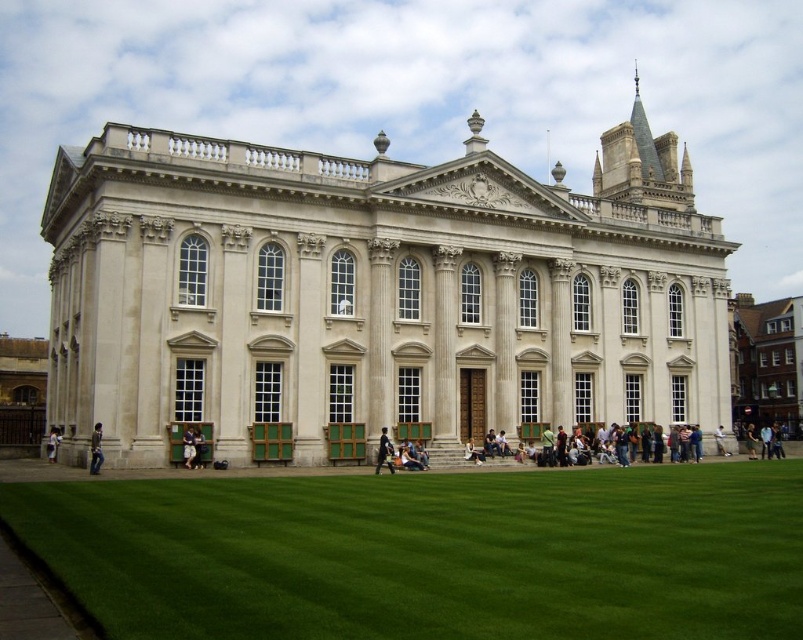
Who is higher up, green grass at lower center or light brown wooden bench at center?

green grass at lower center

At what (x,y) coordinates should I click in order to perform the action: click on green grass at lower center. Please return your answer as a coordinate pair (x, y). Looking at the image, I should click on (430, 554).

Who is positioned more to the right, dark blue fabric jacket at center or light brown wooden chair at lower center?

dark blue fabric jacket at center

Is dark blue fabric jacket at center positioned before light brown wooden chair at lower center?

No, it is not.

Between point (390, 452) and point (202, 460), which one is positioned in front?

Point (202, 460)

Locate an element on the screen. The width and height of the screenshot is (803, 640). dark blue fabric jacket at center is located at coordinates (384, 452).

Is point (377, 449) farther from viewer compared to point (51, 456)?

No, (377, 449) is in front of (51, 456).

Between dark blue fabric jacket at center and light brown leather jacket at lower left, which one has less height?

With less height is light brown leather jacket at lower left.

What are the coordinates of `dark blue fabric jacket at center` in the screenshot? It's located at (384, 452).